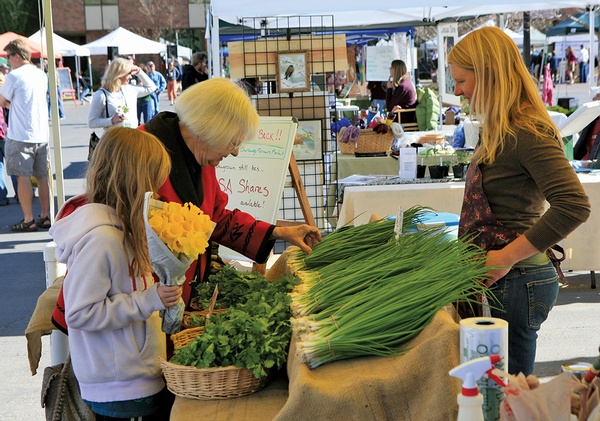
The width and height of the screenshot is (600, 421). Identify the location of pots. [458, 172], [442, 172], [433, 172], [422, 171].